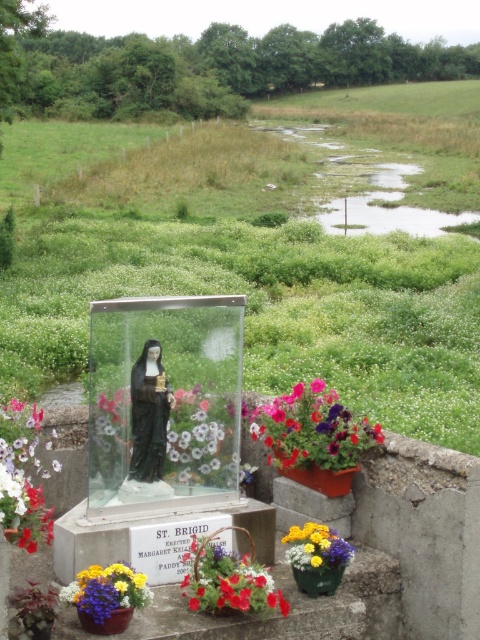
Does purple matte flower at center come behind vibrant multicolored bouquet at lower center?

That is True.

Between point (328, 458) and point (325, 538), which one is positioned behind?

The point (328, 458) is more distant.

Does point (253, 426) lie behind point (346, 561)?

Yes, it is.

Find the location of `purple matte flower at center`. purple matte flower at center is located at coordinates (312, 429).

Is point (88, 596) less distant than point (309, 538)?

Yes, point (88, 596) is closer to viewer.

How much distance is there between multicolored fabric flowers at lower left and vibrant multicolored bouquet at lower center?

multicolored fabric flowers at lower left is 31.37 inches from vibrant multicolored bouquet at lower center.

Between point (131, 602) and point (321, 534), which one is positioned in front?

Point (131, 602) is in front.

Locate an element on the screen. The height and width of the screenshot is (640, 480). multicolored fabric flowers at lower left is located at coordinates (107, 589).

Who is positioned more to the left, matte plastic flowers at lower center or multicolored fabric flowers at lower left?

From the viewer's perspective, multicolored fabric flowers at lower left appears more on the left side.

Where is `matte plastic flowers at lower center`? The width and height of the screenshot is (480, 640). matte plastic flowers at lower center is located at coordinates (228, 580).

You are a GUI agent. You are given a task and a screenshot of the screen. Output one action in this format:
    pyautogui.click(x=<x>, y=<y>)
    Task: Click on the matte plastic flowers at lower center
    This screenshot has width=480, height=640.
    Given the screenshot: What is the action you would take?
    pyautogui.click(x=228, y=580)